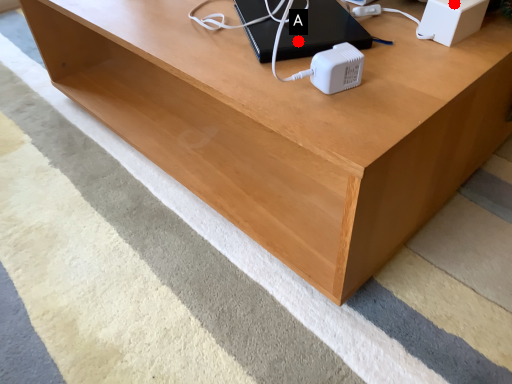
Question: Two points are circled on the image, labeled by A and B beside each circle. Among these points, which one is farthest from the camera?

Choices:
 (A) A is further
 (B) B is further

Answer: (A)